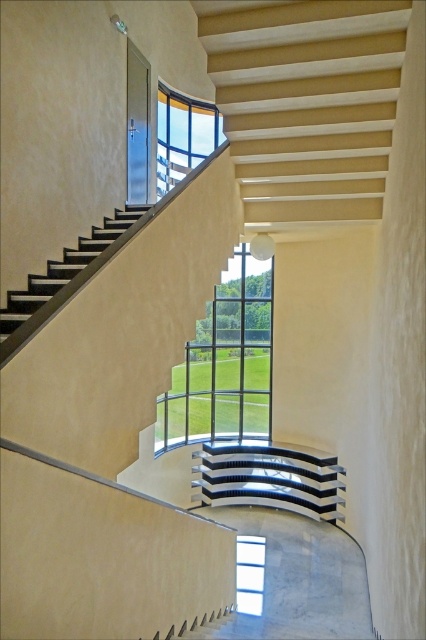
From the picture: Who is more distant from viewer, (221, 346) or (261, 566)?

Point (221, 346)

The width and height of the screenshot is (426, 640). Describe the element at coordinates (224, 364) in the screenshot. I see `clear glass window at center` at that location.

I want to click on clear glass window at center, so click(x=224, y=364).

Where is `clear glass window at center`? The height and width of the screenshot is (640, 426). clear glass window at center is located at coordinates tap(224, 364).

The image size is (426, 640). Identify the location of black glossy stair at center. (268, 477).

Locate an element on the screen. The image size is (426, 640). black glossy stair at center is located at coordinates (268, 477).

Is point (166, 160) less distant than point (244, 611)?

No, (166, 160) is behind (244, 611).

Is clear glass window at upper center to the left of transparent glass window at center from the viewer's perspective?

Correct, you'll find clear glass window at upper center to the left of transparent glass window at center.

The image size is (426, 640). Describe the element at coordinates (183, 134) in the screenshot. I see `clear glass window at upper center` at that location.

Where is `clear glass window at upper center`? The image size is (426, 640). clear glass window at upper center is located at coordinates (183, 134).